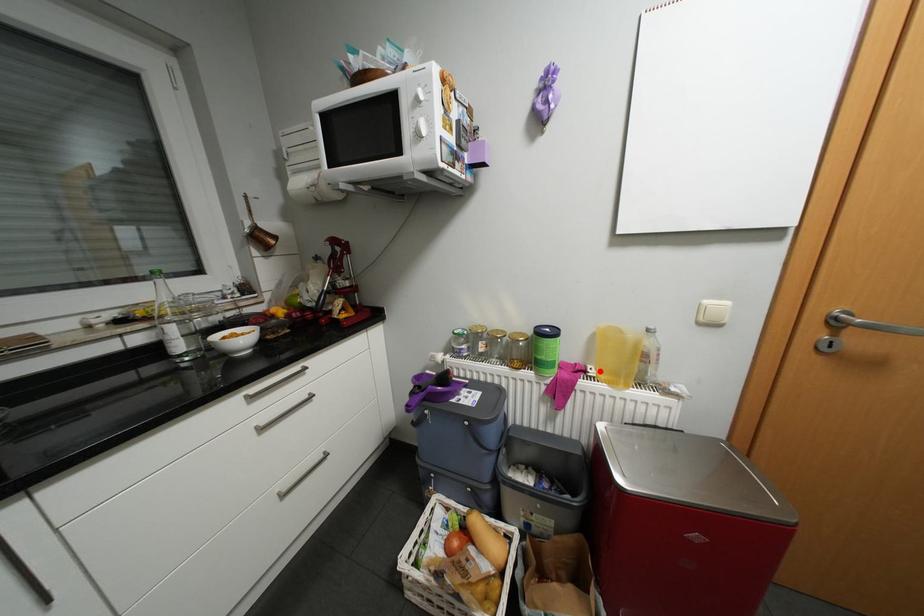
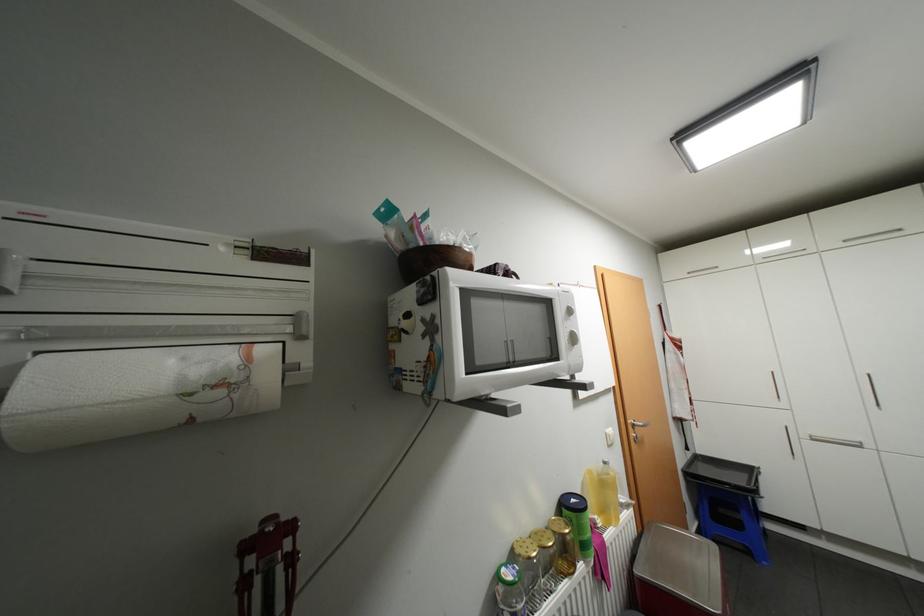
Question: I am providing you with two images of the same scene from different viewpoints. A red point is shown in image1. For the corresponding object point in image2, is it positioned nearer or farther from the camera?

Choices:
 (A) Nearer
 (B) Farther

Answer: (B)